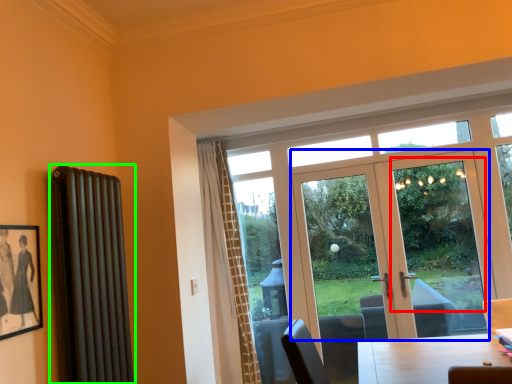
Question: Estimate the real-world distances between objects in this image. Which object is farther from window screen (highlighted by a red box), door (highlighted by a blue box) or radiator (highlighted by a green box)?

Choices:
 (A) door
 (B) radiator

Answer: (B)